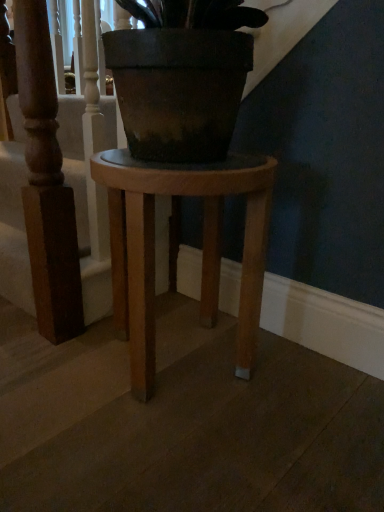
Question: Is wooden stool at center to the left or to the right of wooden stool at center in the image?

Choices:
 (A) left
 (B) right

Answer: (A)

Question: Is point (69, 158) positioned closer to the camera than point (127, 297)?

Choices:
 (A) farther
 (B) closer

Answer: (A)

Question: From the image's perspective, is wooden stool at center located above or below wooden stool at center?

Choices:
 (A) above
 (B) below

Answer: (A)

Question: In terms of height, does wooden stool at center look taller or shorter compared to wooden stool at center?

Choices:
 (A) tall
 (B) short

Answer: (B)

Question: Is wooden stool at center situated inside wooden stool at center or outside?

Choices:
 (A) outside
 (B) inside

Answer: (A)

Question: In the image, is wooden stool at center on the left side or the right side of wooden stool at center?

Choices:
 (A) right
 (B) left

Answer: (A)

Question: Looking at the image, does wooden stool at center seem bigger or smaller compared to wooden stool at center?

Choices:
 (A) big
 (B) small

Answer: (A)